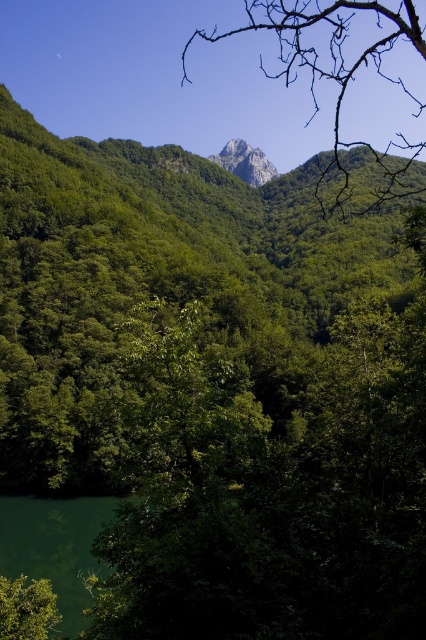
Is point (377, 192) positioned in front of point (256, 186)?

Yes, point (377, 192) is closer to viewer.

Looking at this image, between bare branches at upper center and rugged granite peak at center, which one is positioned lower?

Positioned lower is bare branches at upper center.

This screenshot has height=640, width=426. I want to click on bare branches at upper center, so click(336, 65).

Is green liquid at lower left wider than rugged granite peak at center?

Incorrect, green liquid at lower left's width does not surpass rugged granite peak at center's.

Who is more distant from viewer, (69, 612) or (267, 163)?

Positioned behind is point (267, 163).

You are a GUI agent. You are given a task and a screenshot of the screen. Output one action in this format:
    pyautogui.click(x=<x>, y=<y>)
    Task: Click on the green liquid at lower left
    The width and height of the screenshot is (426, 640).
    Given the screenshot: What is the action you would take?
    pyautogui.click(x=54, y=545)

Between bare branches at upper center and green liquid at lower left, which one has more height?

bare branches at upper center is taller.

This screenshot has width=426, height=640. What do you see at coordinates (336, 65) in the screenshot? I see `bare branches at upper center` at bounding box center [336, 65].

Between point (313, 22) and point (16, 499), which one is positioned in front?

Point (16, 499) is in front.

This screenshot has width=426, height=640. In order to click on bare branches at upper center in this screenshot , I will do `click(336, 65)`.